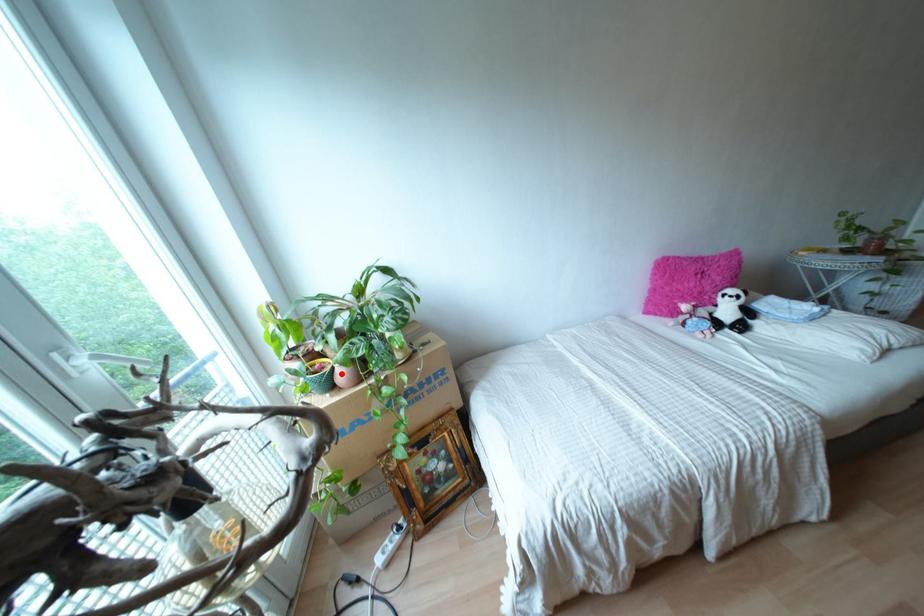
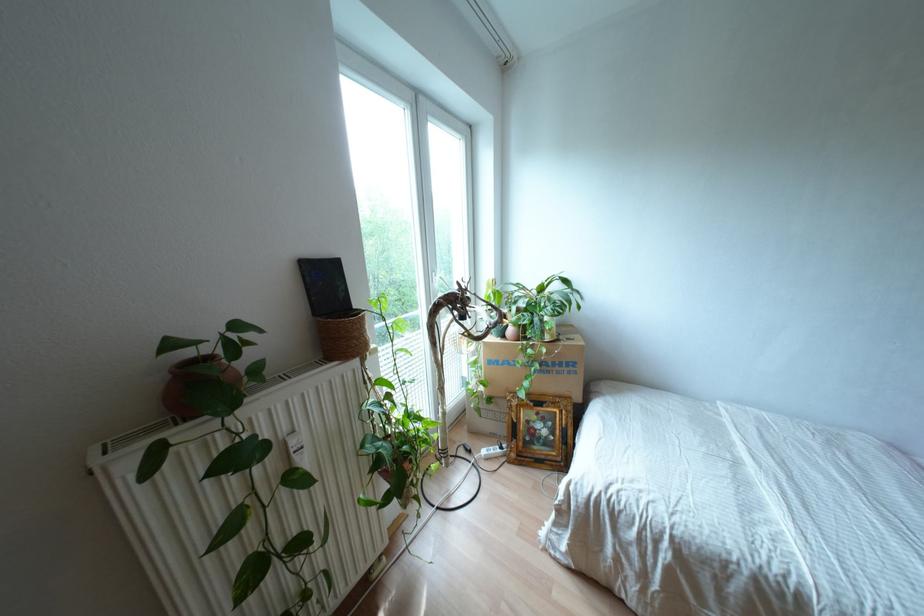
The point at the highlighted location is marked in the first image. Where is the corresponding point in the second image?

(509, 330)